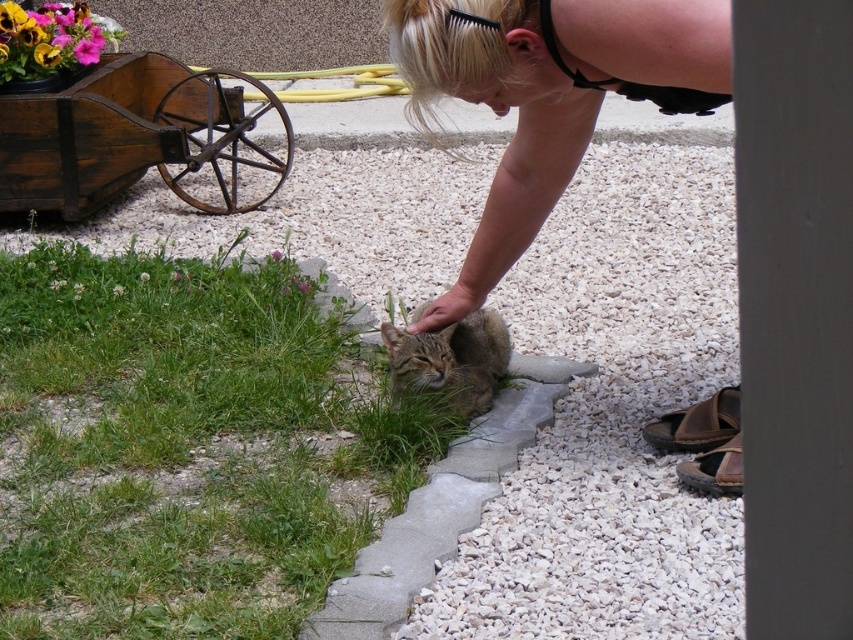
Does point (161, 532) come closer to viewer compared to point (410, 353)?

Yes, it is in front of point (410, 353).

Is point (387, 438) behind point (448, 346)?

No.

The height and width of the screenshot is (640, 853). What do you see at coordinates (184, 445) in the screenshot? I see `green grass at lower left` at bounding box center [184, 445].

Find the location of a particular element. The width and height of the screenshot is (853, 640). green grass at lower left is located at coordinates (184, 445).

Does point (160, 275) lie behind point (698, 84)?

Yes, it is.

Does green grass at lower left have a greater width compared to blonde hair at upper center?

Yes, green grass at lower left is wider than blonde hair at upper center.

Where is `green grass at lower left`? green grass at lower left is located at coordinates (184, 445).

Where is `green grass at lower left`? The image size is (853, 640). green grass at lower left is located at coordinates (184, 445).

Which of these two, blonde hair at upper center or tabby fur cat at center, stands shorter?

tabby fur cat at center

Is point (538, 20) in front of point (451, 410)?

That is True.

Locate an element on the screen. The width and height of the screenshot is (853, 640). blonde hair at upper center is located at coordinates (548, 96).